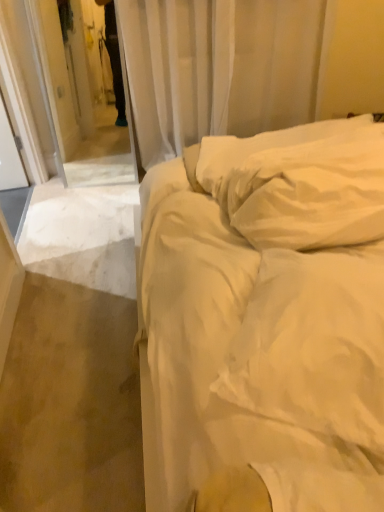
Question: Is white soft pillow at upper right spatially inside white cotton bed at center, or outside of it?

Choices:
 (A) inside
 (B) outside

Answer: (A)

Question: In terms of size, does white soft pillow at upper right appear bigger or smaller than white cotton bed at center?

Choices:
 (A) big
 (B) small

Answer: (B)

Question: Estimate the real-world distances between objects in this image. Which object is closer to the white sheer curtain at upper center?

Choices:
 (A) white soft pillow at upper right
 (B) white cotton bed at center

Answer: (A)

Question: Based on their relative distances, which object is nearer to the white soft pillow at upper right?

Choices:
 (A) white cotton bed at center
 (B) white sheer curtain at upper center

Answer: (A)